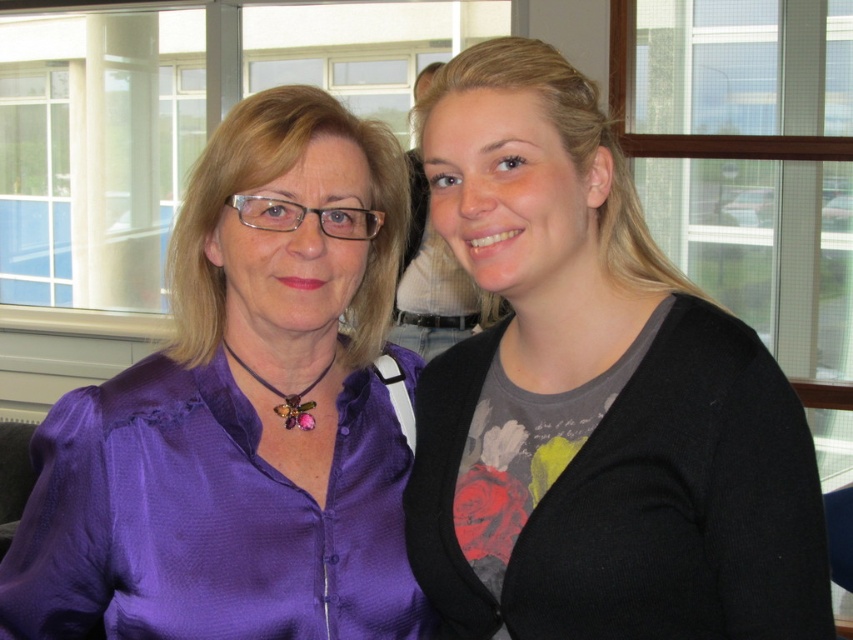
Between black matte sweater at right and purple satin blouse at center, which one is positioned lower?

Positioned lower is purple satin blouse at center.

What do you see at coordinates (595, 397) in the screenshot? This screenshot has width=853, height=640. I see `black matte sweater at right` at bounding box center [595, 397].

Locate an element on the screen. Image resolution: width=853 pixels, height=640 pixels. black matte sweater at right is located at coordinates [x=595, y=397].